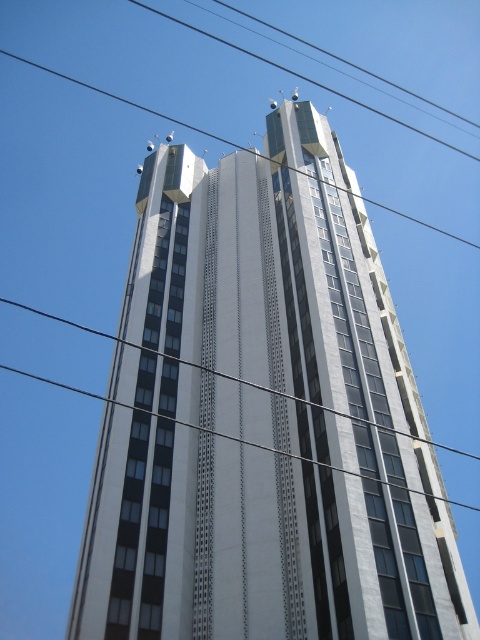
Question: Is white glass building at center in front of metallic wire at center?

Choices:
 (A) yes
 (B) no

Answer: (A)

Question: Does metallic wire at center appear on the right side of black wire at upper center?

Choices:
 (A) no
 (B) yes

Answer: (B)

Question: Among these points, which one is nearest to the camera?

Choices:
 (A) (345, 413)
 (B) (148, 108)
 (C) (213, 576)

Answer: (A)

Question: Considering the real-world distances, which object is farthest from the metallic wire at center?

Choices:
 (A) white glass building at center
 (B) black wire at upper center

Answer: (B)

Question: Which is nearer to the black wire at upper center?

Choices:
 (A) white glass building at center
 (B) metallic wire at center

Answer: (A)

Question: Is white glass building at center below black wire at upper center?

Choices:
 (A) no
 (B) yes

Answer: (B)